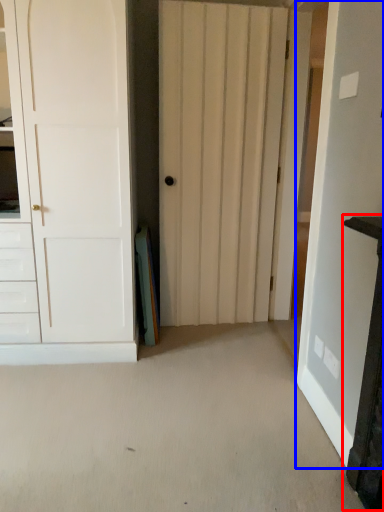
Question: Among these objects, which one is nearest to the camera, vanity (highlighted by a red box) or door (highlighted by a blue box)?

Choices:
 (A) vanity
 (B) door

Answer: (A)